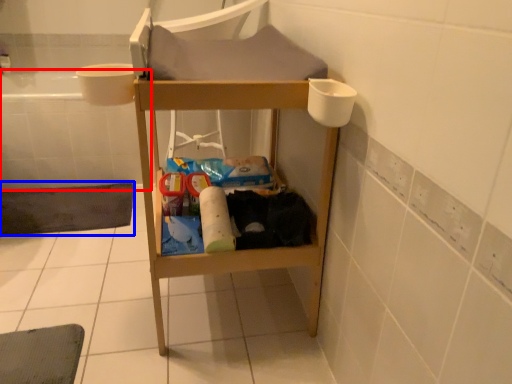
Question: Which object appears closest to the camera in this image, bath (highlighted by a red box) or bath mat (highlighted by a blue box)?

Choices:
 (A) bath
 (B) bath mat

Answer: (B)